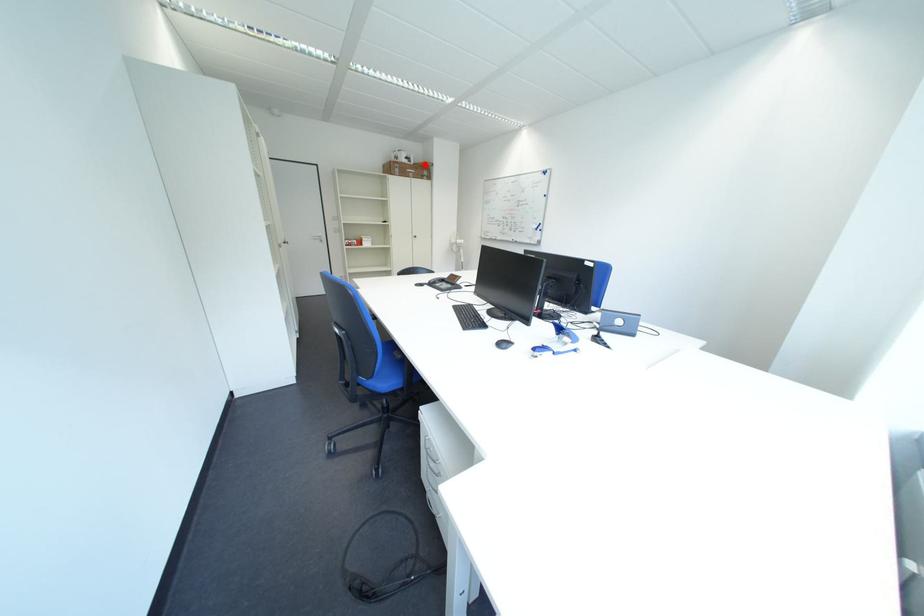
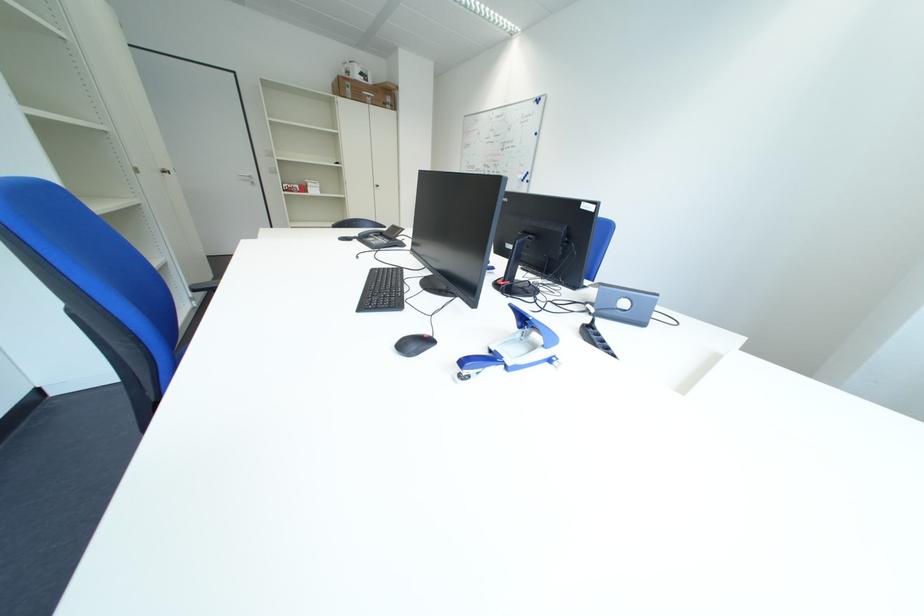
In the second image, find the point that corresponds to the highlighted location in the first image.

(383, 84)